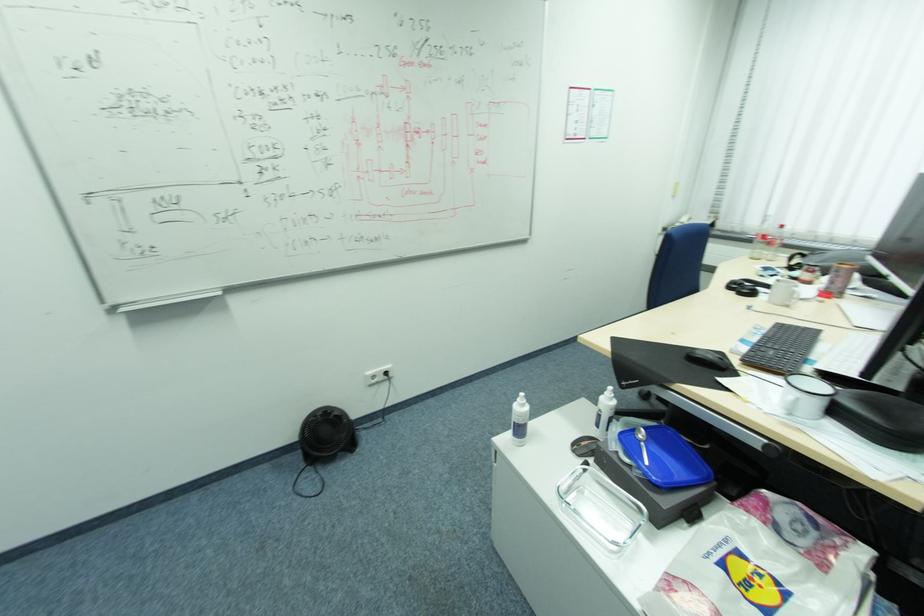
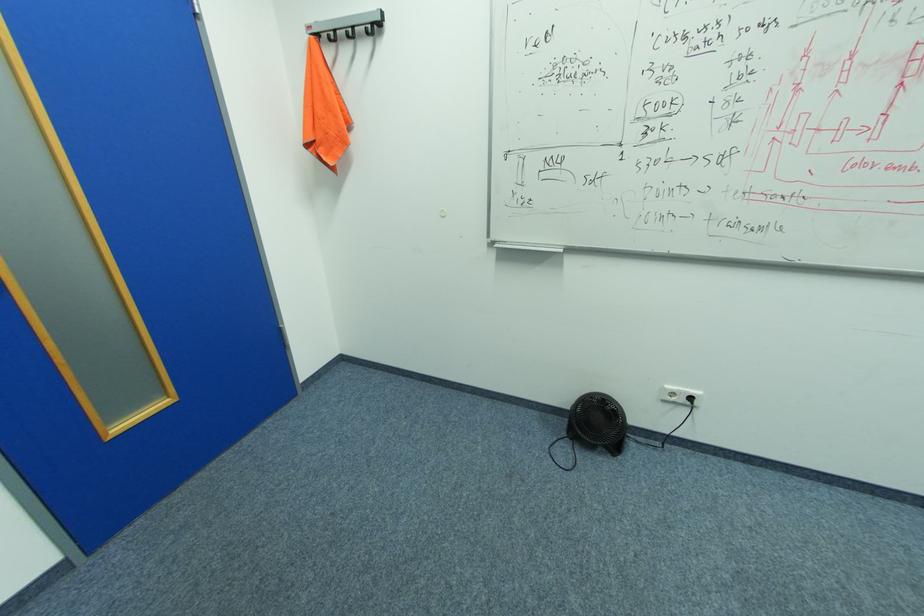
Find the pixel in the second image that matches (x=393, y=373) in the first image.

(698, 399)